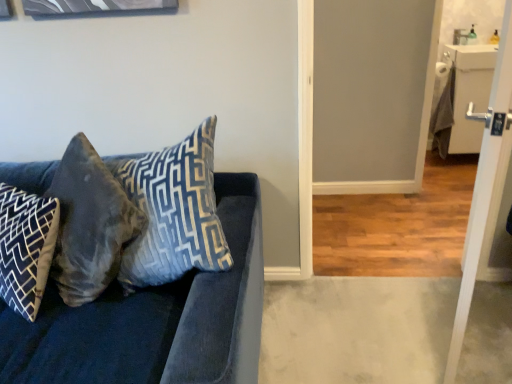
This screenshot has width=512, height=384. Identify the location of velvet blue couch at left. (140, 269).

In order to click on velvet gray pillow at left, which is the 2th pillow in left-to-right order in this screenshot , I will do `click(89, 224)`.

What is the approximate height of blue-patterned fabric pillow at left, which is the third pillow from right to left?

blue-patterned fabric pillow at left, which is the third pillow from right to left, is 33.37 centimeters tall.

Where is `velvet blue couch at left`? velvet blue couch at left is located at coordinates (140, 269).

From the image's perspective, is white glossy door at right above or below blue-patterned fabric pillow at left, which is the 1th pillow in left-to-right order?

From the image's perspective, white glossy door at right appears above blue-patterned fabric pillow at left, which is the 1th pillow in left-to-right order.

From a real-world perspective, is white glossy door at right positioned above or below blue-patterned fabric pillow at left, which is the third pillow from right to left?

From a real-world perspective, white glossy door at right is physically above blue-patterned fabric pillow at left, which is the third pillow from right to left.

Identify the location of screen door that is above the blue-patterned fabric pillow at left, which is the third pillow from right to left (from a real-world perspective). (488, 197).

Which of these two, white glossy door at right or velvet blue pillow at center, the 3th pillow in the left-to-right sequence, is smaller?

Smaller between the two is velvet blue pillow at center, the 3th pillow in the left-to-right sequence.

Is velvet blue pillow at center, the 3th pillow in the left-to-right sequence, located within white glossy door at right?

No, white glossy door at right does not contain velvet blue pillow at center, the 3th pillow in the left-to-right sequence.

From a real-world perspective, is white glossy door at right located beneath velvet blue pillow at center, the 1th pillow viewed from the right?

Yes.

Which is behind, white glossy door at right or velvet blue pillow at center, the 3th pillow in the left-to-right sequence?

velvet blue pillow at center, the 3th pillow in the left-to-right sequence.

Between point (497, 73) and point (135, 237), which one is positioned in front?

Point (135, 237)

Could you tell me if white glossy door at right is turned towards velvet blue couch at left?

Yes, white glossy door at right is turned towards velvet blue couch at left.

From a real-world perspective, which is physically above, white glossy door at right or velvet blue couch at left?

From a 3D spatial view, white glossy door at right is above.

Considering the sizes of objects velvet blue pillow at center, the 3th pillow in the left-to-right sequence, and blue-patterned fabric pillow at left, which is the 1th pillow in left-to-right order, in the image provided, who is thinner, velvet blue pillow at center, the 3th pillow in the left-to-right sequence, or blue-patterned fabric pillow at left, which is the 1th pillow in left-to-right order,?

velvet blue pillow at center, the 3th pillow in the left-to-right sequence.

Is blue-patterned fabric pillow at left, which is the 1th pillow in left-to-right order, surrounded by velvet blue pillow at center, the 3th pillow in the left-to-right sequence?

Definitely not — blue-patterned fabric pillow at left, which is the 1th pillow in left-to-right order, is not inside velvet blue pillow at center, the 3th pillow in the left-to-right sequence.

From the image's perspective, would you say velvet blue pillow at center, the 1th pillow viewed from the right, is positioned over blue-patterned fabric pillow at left, which is the 1th pillow in left-to-right order?

Yes, from the image's perspective, velvet blue pillow at center, the 1th pillow viewed from the right, is above blue-patterned fabric pillow at left, which is the 1th pillow in left-to-right order.

Looking at this image, is velvet blue pillow at center, the 1th pillow viewed from the right, placed right next to blue-patterned fabric pillow at left, which is the 1th pillow in left-to-right order?

No, velvet blue pillow at center, the 1th pillow viewed from the right, is not in contact with blue-patterned fabric pillow at left, which is the 1th pillow in left-to-right order.

From a real-world perspective, is velvet blue couch at left located higher than blue-patterned fabric pillow at left, which is the third pillow from right to left?

Incorrect, from a real-world perspective, velvet blue couch at left is lower than blue-patterned fabric pillow at left, which is the third pillow from right to left.

Is velvet blue couch at left not close to blue-patterned fabric pillow at left, which is the third pillow from right to left?

velvet blue couch at left is near blue-patterned fabric pillow at left, which is the third pillow from right to left, not far away.

Considering the positions of points (25, 196) and (49, 225), is point (25, 196) closer to camera compared to point (49, 225)?

No, it is not.

Does point (179, 178) appear closer or farther from the camera than point (465, 244)?

Point (179, 178) appears to be closer to the viewer than point (465, 244).

Can you tell me how much velvet blue pillow at center, the 1th pillow viewed from the right, and white glossy door at right differ in facing direction?

The angle between the facing direction of velvet blue pillow at center, the 1th pillow viewed from the right, and the facing direction of white glossy door at right is 113 degrees.

How distant is velvet blue pillow at center, the 3th pillow in the left-to-right sequence, from white glossy door at right?

velvet blue pillow at center, the 3th pillow in the left-to-right sequence, is 89.94 centimeters away from white glossy door at right.

Which object is positioned more to the left, velvet blue pillow at center, the 1th pillow viewed from the right, or white glossy door at right?

velvet blue pillow at center, the 1th pillow viewed from the right.

From a real-world perspective, which object stands above the other?

velvet blue pillow at center, the 1th pillow viewed from the right, from a real-world perspective.

This screenshot has height=384, width=512. What are the coordinates of `the 2nd pillow counting from the right side of the blue-patterned fabric pillow at left, which is the third pillow from right to left` in the screenshot? It's located at (173, 212).

Do you think blue-patterned fabric pillow at left, which is the third pillow from right to left, is within velvet blue pillow at center, the 1th pillow viewed from the right, or outside of it?

blue-patterned fabric pillow at left, which is the third pillow from right to left, is outside velvet blue pillow at center, the 1th pillow viewed from the right.

Considering the sizes of objects blue-patterned fabric pillow at left, which is the 1th pillow in left-to-right order, and velvet blue pillow at center, the 3th pillow in the left-to-right sequence, in the image provided, who is taller, blue-patterned fabric pillow at left, which is the 1th pillow in left-to-right order, or velvet blue pillow at center, the 3th pillow in the left-to-right sequence,?

velvet blue pillow at center, the 3th pillow in the left-to-right sequence.

The image size is (512, 384). I want to click on screen door lying on the right of blue-patterned fabric pillow at left, which is the 1th pillow in left-to-right order, so click(488, 197).

Where is `screen door located underneath the velvet blue pillow at center, the 1th pillow viewed from the right (from a real-world perspective)`? screen door located underneath the velvet blue pillow at center, the 1th pillow viewed from the right (from a real-world perspective) is located at coordinates (488, 197).

From the image, which object appears to be farther from velvet gray pillow at left, the second pillow from the right, velvet blue couch at left or white glossy door at right?

Among the two, white glossy door at right is located further to velvet gray pillow at left, the second pillow from the right.

When comparing their distances from white glossy door at right, does velvet blue couch at left or velvet blue pillow at center, the 3th pillow in the left-to-right sequence, seem further?

velvet blue couch at left is positioned further to the anchor white glossy door at right.

When comparing their distances from white glossy door at right, does velvet blue couch at left or blue-patterned fabric pillow at left, which is the third pillow from right to left, seem closer?

Among the two, velvet blue couch at left is located nearer to white glossy door at right.

Estimate the real-world distances between objects in this image. Which object is closer to white glossy door at right, blue-patterned fabric pillow at left, which is the third pillow from right to left, or velvet blue couch at left?

velvet blue couch at left lies closer to white glossy door at right than the other object.

Which object lies nearer to the anchor point blue-patterned fabric pillow at left, which is the third pillow from right to left, velvet blue couch at left or white glossy door at right?

Based on the image, velvet blue couch at left appears to be nearer to blue-patterned fabric pillow at left, which is the third pillow from right to left.

Considering their positions, is white glossy door at right positioned closer to velvet gray pillow at left, the second pillow from the right, than blue-patterned fabric pillow at left, which is the 1th pillow in left-to-right order?

blue-patterned fabric pillow at left, which is the 1th pillow in left-to-right order, is positioned closer to the anchor velvet gray pillow at left, the second pillow from the right.

When comparing their distances from velvet blue pillow at center, the 1th pillow viewed from the right, does velvet blue couch at left or velvet gray pillow at left, which is the 2th pillow in left-to-right order, seem closer?

Among the two, velvet blue couch at left is located nearer to velvet blue pillow at center, the 1th pillow viewed from the right.

Based on the photo, estimate the real-world distances between objects in this image. Which object is further from velvet blue pillow at center, the 1th pillow viewed from the right, white glossy door at right or velvet gray pillow at left, which is the 2th pillow in left-to-right order?

Based on the image, white glossy door at right appears to be further to velvet blue pillow at center, the 1th pillow viewed from the right.

Where is `studio couch situated between blue-patterned fabric pillow at left, which is the third pillow from right to left, and velvet blue pillow at center, the 3th pillow in the left-to-right sequence, from left to right`? studio couch situated between blue-patterned fabric pillow at left, which is the third pillow from right to left, and velvet blue pillow at center, the 3th pillow in the left-to-right sequence, from left to right is located at coordinates (140, 269).

This screenshot has width=512, height=384. I want to click on pillow between blue-patterned fabric pillow at left, which is the 1th pillow in left-to-right order, and velvet blue pillow at center, the 1th pillow viewed from the right, in the horizontal direction, so click(89, 224).

The image size is (512, 384). What are the coordinates of `pillow between velvet blue couch at left and velvet gray pillow at left, which is the 2th pillow in left-to-right order, along the z-axis` in the screenshot? It's located at (173, 212).

At what (x,y) coordinates should I click in order to perform the action: click on studio couch situated between blue-patterned fabric pillow at left, which is the 1th pillow in left-to-right order, and white glossy door at right from left to right. Please return your answer as a coordinate pair (x, y). Image resolution: width=512 pixels, height=384 pixels. Looking at the image, I should click on (140, 269).